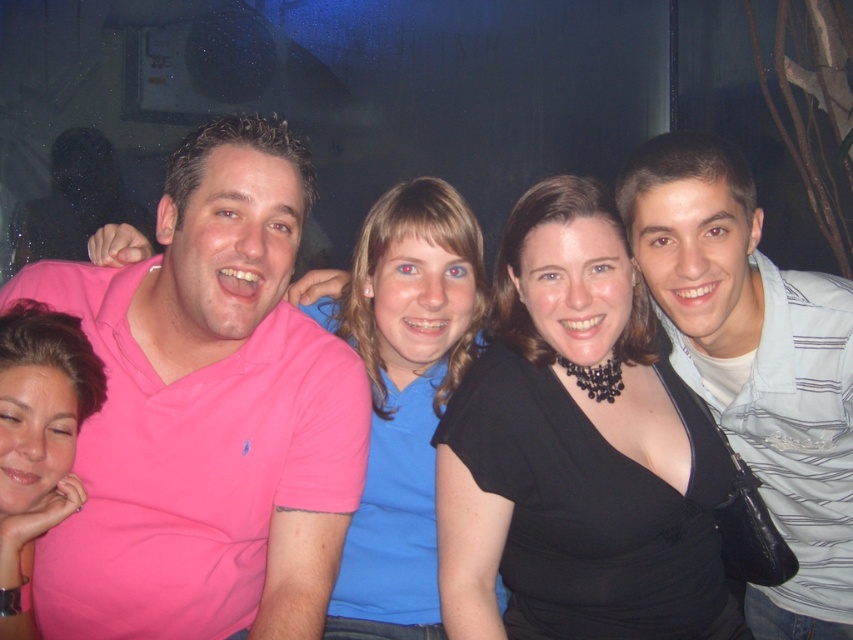
You are a photographer trying to adjust the lighting for a closeup shot of the black matte necklace at center and the matte pink shirt at lower left. Which object should you focus on first if you want to ensure both are in focus without moving the camera?

The black matte necklace at center is above the matte pink shirt at lower left, so you should focus on the matte pink shirt at lower left first because it is closer to the camera. This will ensure the necklace, being further away, remains in focus as well.